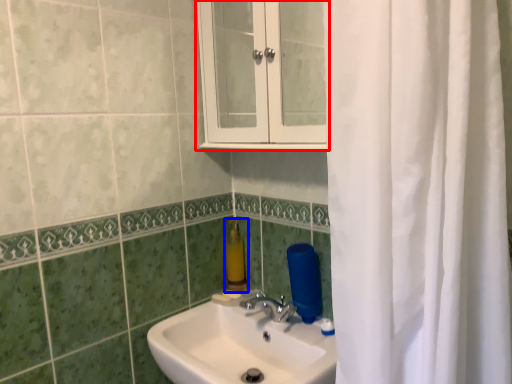
Question: Which object appears farthest to the camera in this image, medicine cabinet (highlighted by a red box) or soap dispenser (highlighted by a blue box)?

Choices:
 (A) medicine cabinet
 (B) soap dispenser

Answer: (B)